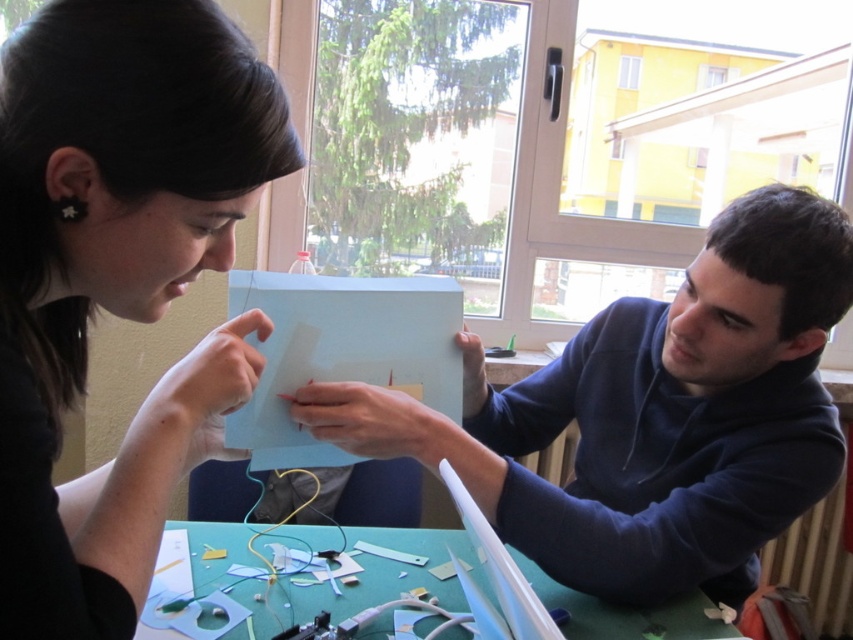
Is point (62, 385) behind point (561, 406)?

No, (62, 385) is closer to viewer.

Measure the distance between matte black paper at upper left and blue matte paper at center.

42.41 centimeters

Where is `matte black paper at upper left`? matte black paper at upper left is located at coordinates (117, 280).

This screenshot has width=853, height=640. I want to click on matte black paper at upper left, so click(x=117, y=280).

Between matte black paper at upper left and green paper at lower center, which one has less height?

green paper at lower center

Image resolution: width=853 pixels, height=640 pixels. Find the location of `matte black paper at upper left`. matte black paper at upper left is located at coordinates (117, 280).

Is point (86, 120) farther from viewer compared to point (590, 596)?

No, it is in front of (590, 596).

The width and height of the screenshot is (853, 640). I want to click on matte black paper at upper left, so click(117, 280).

Does blue matte paper at center appear on the left side of green paper at lower center?

No, blue matte paper at center is not to the left of green paper at lower center.

What do you see at coordinates (653, 416) in the screenshot?
I see `blue matte paper at center` at bounding box center [653, 416].

At what (x,y) coordinates should I click in order to perform the action: click on blue matte paper at center. Please return your answer as a coordinate pair (x, y). The height and width of the screenshot is (640, 853). Looking at the image, I should click on (653, 416).